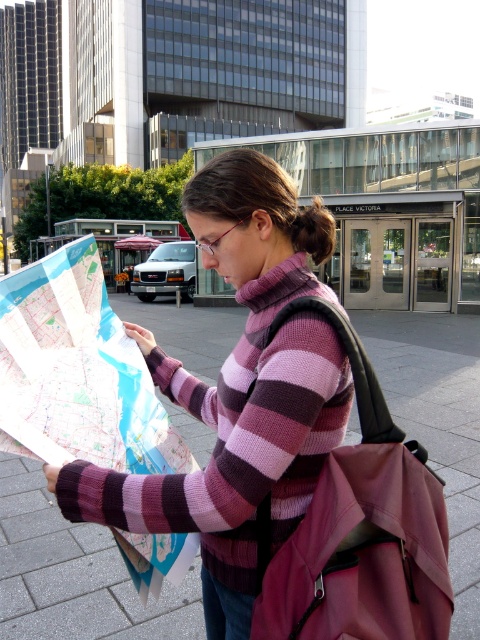
Is point (57, 332) farther from viewer compared to point (295, 230)?

Yes, it is.

Does point (60, 392) come behind point (327, 234)?

No, (60, 392) is in front of (327, 234).

You are a GUI agent. You are given a task and a screenshot of the screen. Output one action in this format:
    pyautogui.click(x=<x>, y=<y>)
    Task: Click on the paper map at center
    This screenshot has width=480, height=640.
    Given the screenshot: What is the action you would take?
    pyautogui.click(x=76, y=371)

Is striped sweater at center to the left of brown hair at center from the viewer's perspective?

Indeed, striped sweater at center is positioned on the left side of brown hair at center.

This screenshot has height=640, width=480. I want to click on striped sweater at center, so click(x=236, y=397).

Is point (301, 316) in front of point (315, 205)?

Yes, point (301, 316) is closer to viewer.

Locate an element on the screen. striped sweater at center is located at coordinates (236, 397).

Is striped sweater at center wider than paper map at center?

Indeed, striped sweater at center has a greater width compared to paper map at center.

I want to click on striped sweater at center, so click(x=236, y=397).